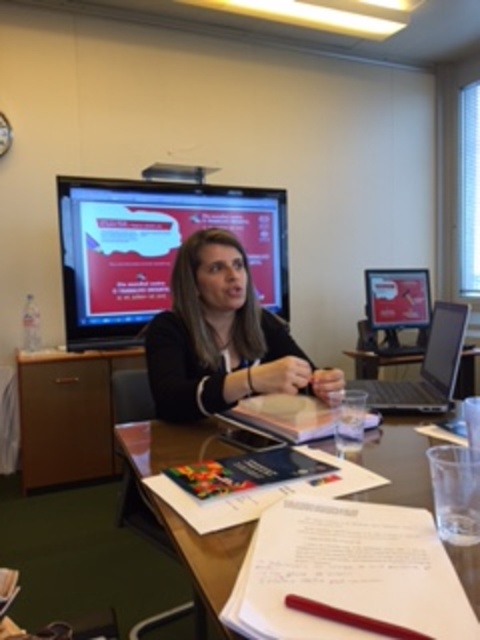
Question: Which object appears farthest from the camera in this image?

Choices:
 (A) matte black monitor at upper center
 (B) white paper at center

Answer: (A)

Question: Where is matte black jacket at center located in relation to satin silver laptop at right in the image?

Choices:
 (A) left
 (B) right

Answer: (A)

Question: From the image, what is the correct spatial relationship of matte black monitor at upper center in relation to satin silver laptop at right?

Choices:
 (A) left
 (B) right

Answer: (A)

Question: Does matte black jacket at center have a smaller size compared to satin silver laptop at right?

Choices:
 (A) no
 (B) yes

Answer: (A)

Question: Which point is farther to the camera?

Choices:
 (A) matte black monitor at upper center
 (B) white paper at center

Answer: (A)

Question: Which point is farther from the camera taking this photo?

Choices:
 (A) (282, 272)
 (B) (375, 460)
 (C) (172, 356)
 (D) (463, 317)

Answer: (A)